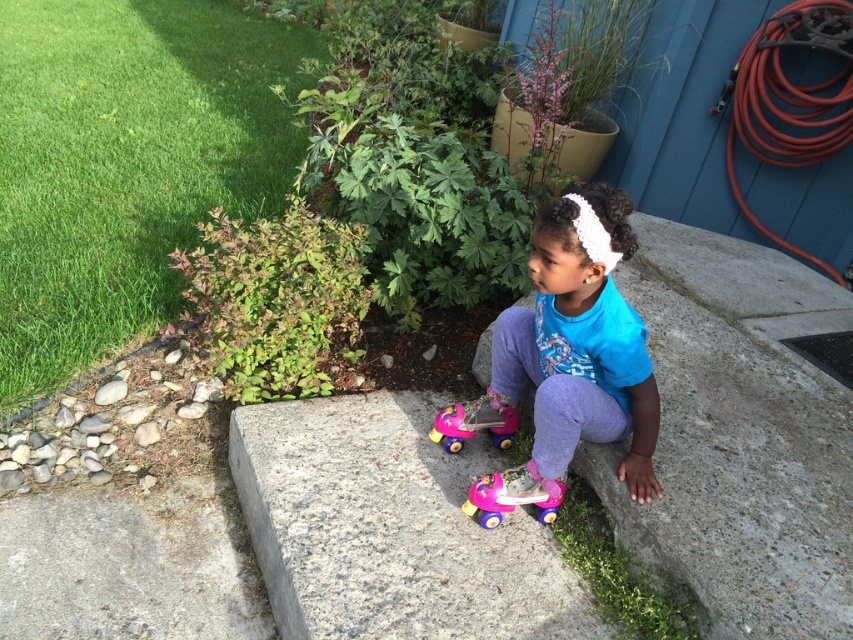
Question: Among these points, which one is farthest from the camera?

Choices:
 (A) (334, 588)
 (B) (654, 445)

Answer: (B)

Question: Estimate the real-world distances between objects in this image. Which object is closer to the blue matte shirt at center?

Choices:
 (A) pink plastic walker at lower center
 (B) gray granite concrete at center
 (C) pink plastic toy at center

Answer: (A)

Question: Does pink plastic walker at lower center have a smaller size compared to pink plastic toy at center?

Choices:
 (A) no
 (B) yes

Answer: (B)

Question: Which point is farther to the camera?

Choices:
 (A) (456, 410)
 (B) (547, 493)
 (C) (540, 381)
 (D) (387, 460)

Answer: (A)

Question: Is pink plastic walker at lower center below pink plastic toy at center?

Choices:
 (A) no
 (B) yes

Answer: (B)

Question: Does blue matte shirt at center come in front of pink plastic toy at center?

Choices:
 (A) yes
 (B) no

Answer: (A)